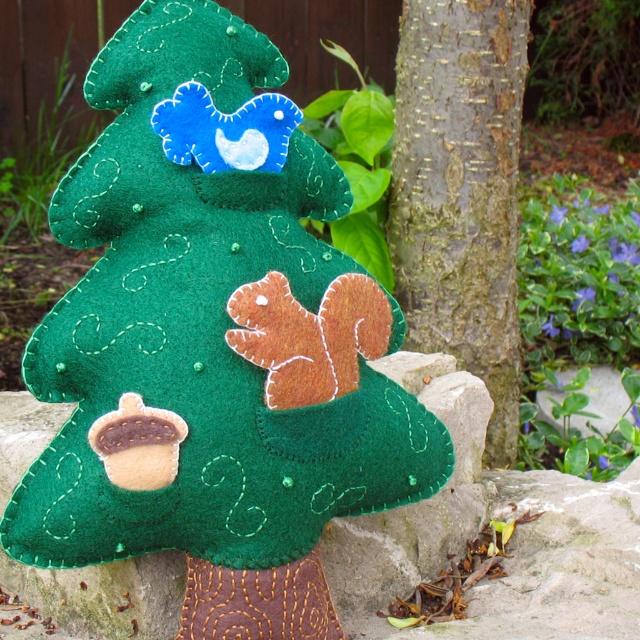
You are standing in front of the handmade felt tree decoration. You see the felt squirrel at center and the rough bark tree trunk at center. Which object is positioned to the right side?

The rough bark tree trunk at center is positioned to the right of the felt squirrel at center.

You are an artist planning to sketch the felt squirrel at center and the rough bark tree trunk at center. If you want to draw them to scale, which one should you allocate more space for?

The felt squirrel at center is wider than the rough bark tree trunk at center, so you should allocate more space for the felt squirrel at center.

You are standing in front of the handmade felt tree decoration. There is a point marked at coordinates (212, 340). What object is located at this point on the tree?

The point at coordinates (212, 340) corresponds to the felt squirrel at center.